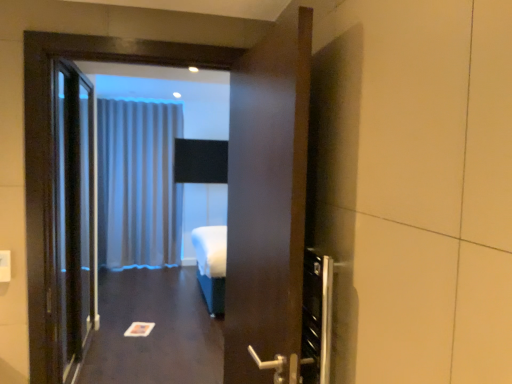
Question: Is satin fabric curtain at center bigger than black glass elevator door at left?

Choices:
 (A) no
 (B) yes

Answer: (B)

Question: Is satin fabric curtain at center positioned with its back to black glass elevator door at left?

Choices:
 (A) no
 (B) yes

Answer: (A)

Question: Is satin fabric curtain at center smaller than black glass elevator door at left?

Choices:
 (A) no
 (B) yes

Answer: (A)

Question: Is satin fabric curtain at center to the right of black glass elevator door at left from the viewer's perspective?

Choices:
 (A) no
 (B) yes

Answer: (A)

Question: From the image's perspective, is satin fabric curtain at center below black glass elevator door at left?

Choices:
 (A) yes
 (B) no

Answer: (B)

Question: Considering their positions, is black glass elevator door at left located in front of or behind white glossy paper at center?

Choices:
 (A) front
 (B) behind

Answer: (A)

Question: Considering the positions of black glass elevator door at left and white glossy paper at center in the image, is black glass elevator door at left taller or shorter than white glossy paper at center?

Choices:
 (A) short
 (B) tall

Answer: (B)

Question: From a real-world perspective, is black glass elevator door at left physically located above or below white glossy paper at center?

Choices:
 (A) below
 (B) above

Answer: (B)

Question: Is black glass elevator door at left spatially inside white glossy paper at center, or outside of it?

Choices:
 (A) inside
 (B) outside

Answer: (B)

Question: Is white glossy paper at center taller or shorter than satin fabric curtain at center?

Choices:
 (A) short
 (B) tall

Answer: (A)

Question: From the image's perspective, relative to satin fabric curtain at center, is white glossy paper at center above or below?

Choices:
 (A) below
 (B) above

Answer: (A)

Question: Is point (92, 349) positioned closer to the camera than point (136, 203)?

Choices:
 (A) farther
 (B) closer

Answer: (B)

Question: From a real-world perspective, relative to satin fabric curtain at center, is white glossy paper at center vertically above or below?

Choices:
 (A) above
 (B) below

Answer: (B)

Question: In terms of size, does black glass elevator door at left appear bigger or smaller than satin fabric curtain at center?

Choices:
 (A) big
 (B) small

Answer: (B)

Question: In terms of height, does black glass elevator door at left look taller or shorter compared to satin fabric curtain at center?

Choices:
 (A) short
 (B) tall

Answer: (A)